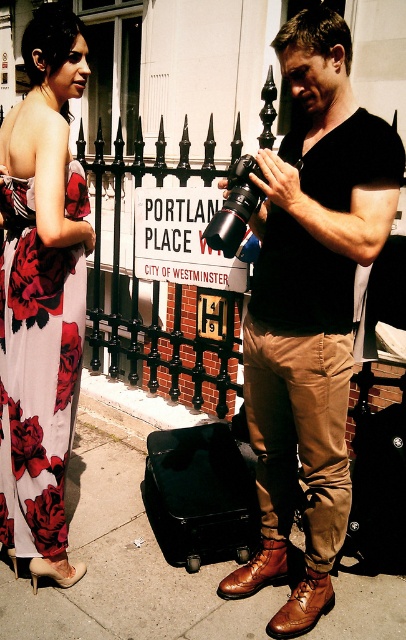
Question: Which point is farther to the camera?

Choices:
 (A) (295, 177)
 (B) (351, 600)
 (C) (226, 541)
 (D) (0, 388)

Answer: (C)

Question: Among these objects, which one is farthest from the camera?

Choices:
 (A) black matte suitcase at center
 (B) floral printed fabric dress at left

Answer: (A)

Question: Is floral printed fabric dress at left behind black leather suitcase at center?

Choices:
 (A) yes
 (B) no

Answer: (B)

Question: Can you confirm if matte black shirt at center is positioned to the left of black leather suitcase at center?

Choices:
 (A) yes
 (B) no

Answer: (A)

Question: Is matte black shirt at center thinner than black matte suitcase at center?

Choices:
 (A) no
 (B) yes

Answer: (B)

Question: Which point is closer to the camera taking this photo?

Choices:
 (A) (8, 220)
 (B) (112, 573)
 (C) (278, 372)
 (D) (386, 445)

Answer: (C)